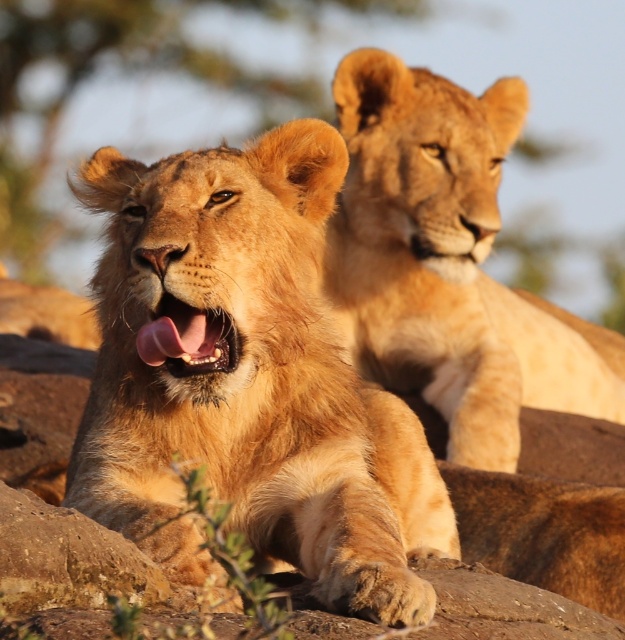
Is golden fur lion at center taller than pink glossy tongue at center?

Correct, golden fur lion at center is much taller as pink glossy tongue at center.

Can you confirm if golden fur lion at center is positioned above pink glossy tongue at center?

No.

The image size is (625, 640). Describe the element at coordinates (251, 381) in the screenshot. I see `golden fur lion at center` at that location.

At what (x,y) coordinates should I click in order to perform the action: click on golden fur lion at center. Please return your answer as a coordinate pair (x, y). Image resolution: width=625 pixels, height=640 pixels. Looking at the image, I should click on (251, 381).

Measure the distance between golden fur lion at center and camera.

golden fur lion at center is 2.21 meters from camera.

Who is more forward, (161, 371) or (492, 365)?

Point (161, 371) is in front.

This screenshot has height=640, width=625. In order to click on golden fur lion at center in this screenshot , I will do `click(251, 381)`.

Who is positioned more to the left, golden fur lion at upper center or pink glossy tongue at center?

pink glossy tongue at center

Is point (455, 456) positioned in front of point (196, 346)?

No, it is behind (196, 346).

In order to click on golden fur lion at upper center in this screenshot , I will do `click(448, 262)`.